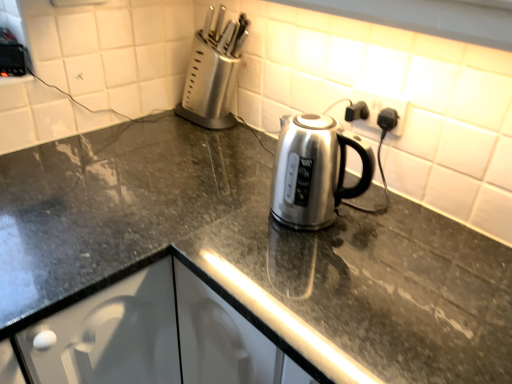
Where is `black plastic outlet at upper right`? black plastic outlet at upper right is located at coordinates (382, 108).

Who is more distant, black plastic outlet at upper right or slate gray granite countertop at center?

black plastic outlet at upper right is behind.

From a real-world perspective, is black plastic outlet at upper right physically located above or below slate gray granite countertop at center?

From a real-world perspective, black plastic outlet at upper right is physically above slate gray granite countertop at center.

Can you confirm if black plastic outlet at upper right is smaller than slate gray granite countertop at center?

Yes, black plastic outlet at upper right is smaller than slate gray granite countertop at center.

Is there a large distance between slate gray granite countertop at center and black plastic outlet at upper right?

slate gray granite countertop at center is actually quite close to black plastic outlet at upper right.

Is slate gray granite countertop at center behind black plastic outlet at upper right?

No, slate gray granite countertop at center is in front of black plastic outlet at upper right.

Between point (79, 151) and point (357, 95), which one is positioned in front?

The point (357, 95) is more forward.

From the image's perspective, is slate gray granite countertop at center above black plastic outlet at upper right?

No, from the image's perspective, slate gray granite countertop at center is not over black plastic outlet at upper right.

Is slate gray granite countertop at center far from satin silver knife block at upper left?

Actually, slate gray granite countertop at center and satin silver knife block at upper left are a little close together.

Based on the photo, which of these two, slate gray granite countertop at center or satin silver knife block at upper left, is wider?

slate gray granite countertop at center.

Who is taller, slate gray granite countertop at center or satin silver knife block at upper left?

slate gray granite countertop at center.

Looking at this image, which point is more distant from viewer, (439, 221) or (192, 63)?

The point (192, 63) is more distant.

Does black plastic outlet at upper right have a greater width compared to satin silver knife block at upper left?

Incorrect, the width of black plastic outlet at upper right does not surpass that of satin silver knife block at upper left.

Is black plastic outlet at upper right next to satin silver knife block at upper left?

No, black plastic outlet at upper right is not making contact with satin silver knife block at upper left.

Choose the correct answer: Is black plastic outlet at upper right inside satin silver knife block at upper left or outside it?

The correct answer is: outside.

Which is nearer, (x=372, y=105) or (x=197, y=102)?

Clearly, point (x=372, y=105) is closer to the camera than point (x=197, y=102).

Is satin silver knife block at upper left not close to black plastic outlet at upper right?

No, satin silver knife block at upper left is not far from black plastic outlet at upper right.

Considering the relative positions of satin silver knife block at upper left and black plastic outlet at upper right in the image provided, is satin silver knife block at upper left to the left or to the right of black plastic outlet at upper right?

From the image, it's evident that satin silver knife block at upper left is to the left of black plastic outlet at upper right.

Is satin silver knife block at upper left wider or thinner than black plastic outlet at upper right?

In the image, satin silver knife block at upper left appears to be wider than black plastic outlet at upper right.

Consider the image. From the image's perspective, which object appears higher, satin silver knife block at upper left or black plastic outlet at upper right?

satin silver knife block at upper left, from the image's perspective.

Measure the distance from satin silver knife block at upper left to slate gray granite countertop at center.

19.66 inches.

From the image's perspective, does satin silver knife block at upper left appear higher than slate gray granite countertop at center?

Yes, from the image's perspective, satin silver knife block at upper left is over slate gray granite countertop at center.

From a real-world perspective, is satin silver knife block at upper left on top of slate gray granite countertop at center?

Indeed, from a real-world perspective, satin silver knife block at upper left stands above slate gray granite countertop at center.

How different are the orientations of satin silver knife block at upper left and slate gray granite countertop at center in degrees?

There is a 90.5-degree angle between the facing directions of satin silver knife block at upper left and slate gray granite countertop at center.

I want to click on countertop that appears in front of the black plastic outlet at upper right, so click(x=253, y=247).

Locate an element on the screen. This screenshot has width=512, height=384. electric outlet located behind the slate gray granite countertop at center is located at coordinates (382, 108).

Looking at this image, from the image, which object appears to be farther from satin silver knife block at upper left, slate gray granite countertop at center or black plastic outlet at upper right?

slate gray granite countertop at center is positioned further to the anchor satin silver knife block at upper left.

Looking at the image, which one is located further to satin silver knife block at upper left, black plastic outlet at upper right or slate gray granite countertop at center?

Based on the image, slate gray granite countertop at center appears to be further to satin silver knife block at upper left.

Looking at this image, from the image, which object appears to be farther from black plastic outlet at upper right, satin silver knife block at upper left or slate gray granite countertop at center?

Based on the image, slate gray granite countertop at center appears to be further to black plastic outlet at upper right.

Looking at the image, which one is located further to slate gray granite countertop at center, satin silver knife block at upper left or black plastic outlet at upper right?

satin silver knife block at upper left.

From the image, which object appears to be nearer to black plastic outlet at upper right, slate gray granite countertop at center or satin silver knife block at upper left?

satin silver knife block at upper left lies closer to black plastic outlet at upper right than the other object.

Based on their spatial positions, is black plastic outlet at upper right or satin silver knife block at upper left closer to slate gray granite countertop at center?

Among the two, black plastic outlet at upper right is located nearer to slate gray granite countertop at center.

Locate an element on the screen. This screenshot has height=384, width=512. electric outlet between satin silver knife block at upper left and slate gray granite countertop at center vertically is located at coordinates pyautogui.click(x=382, y=108).